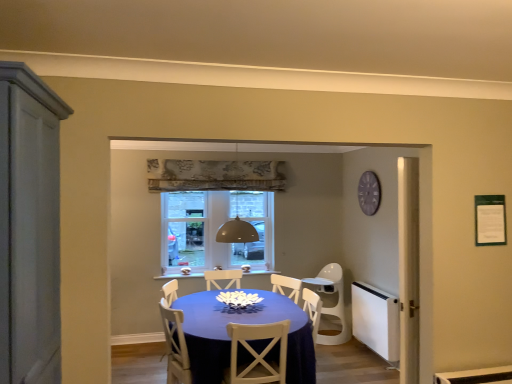
Question: Is matte blue table at center inside the boundaries of clear glass window at center, or outside?

Choices:
 (A) outside
 (B) inside

Answer: (A)

Question: In terms of size, does matte blue table at center appear bigger or smaller than clear glass window at center?

Choices:
 (A) big
 (B) small

Answer: (A)

Question: Which of these objects is positioned farthest from the matte blue table at center?

Choices:
 (A) white matte door at left
 (B) white wood chair at center, the second chair from the right
 (C) white plastic chair at center, placed as the second chair when sorted from left to right
 (D) clear glass window at center
 (E) white matte radiator at right

Answer: (D)

Question: Which object is positioned closest to the purple wooden clock at upper right?

Choices:
 (A) white plastic chair at center, positioned as the first chair in back-to-front order
 (B) clear glass window at center
 (C) white wood chair at center, which is the second chair from back to front
 (D) white matte radiator at right
 (E) white matte door at left

Answer: (D)